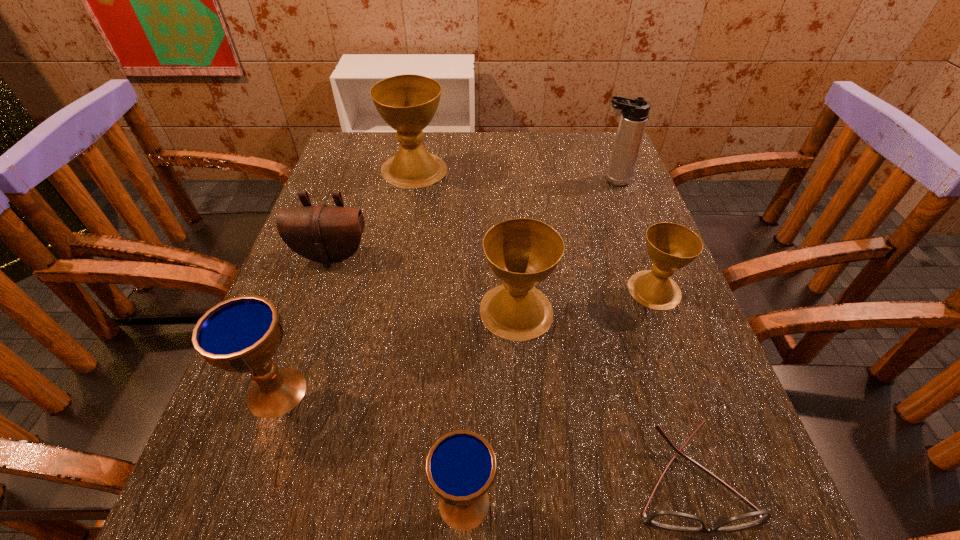
This screenshot has width=960, height=540. Identify the location of object present at the far left corner. (407, 103).

Find the location of a particular element. This screenshot has height=540, width=960. object that is at the far right corner is located at coordinates pyautogui.click(x=634, y=112).

Locate an element on the screen. object present at the near right corner is located at coordinates (672, 520).

The image size is (960, 540). Find the location of `free space at the far edge of the desktop`. free space at the far edge of the desktop is located at coordinates (454, 151).

Find the location of a particular element. free space at the near edge of the desktop is located at coordinates (564, 515).

Find the location of a particular element. The width and height of the screenshot is (960, 540). vacant space at the left edge of the desktop is located at coordinates (351, 184).

Identify the location of vacant space at the right edge of the desktop. This screenshot has width=960, height=540. (625, 387).

This screenshot has height=540, width=960. I want to click on vacant space at the far left corner of the desktop, so click(x=346, y=177).

Locate an element on the screen. free space at the far right corner of the desktop is located at coordinates (608, 157).

Identify the location of vacant area at the near right corner. The width and height of the screenshot is (960, 540). (706, 492).